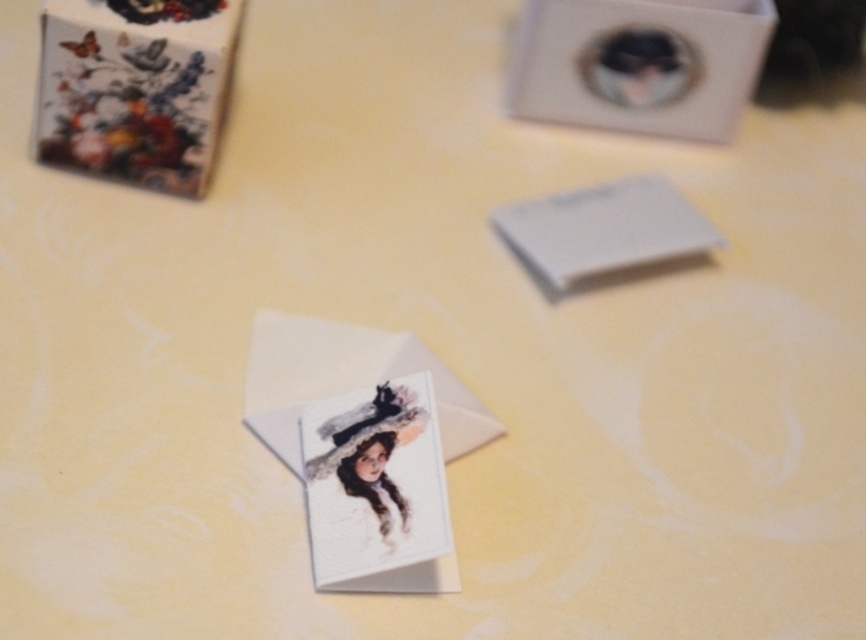
You are a photographer taking a closeup shot of the watercolor paper card at center and the white paper envelope at center on a table. Which object will appear larger in your photo?

The watercolor paper card at center will appear larger in the photo because it is closer to the viewer than the white paper envelope at center.

You are organizing items on a table and need to place both the white cardboard box at upper center and the watercolor paper card at center. Since you want to ensure the smaller item is closer to the edge of the table for easy access, which item should you move closer to the edge?

The watercolor paper card at center is smaller than the white cardboard box at upper center, so you should move the watercolor paper card at center closer to the edge of the table for easier access.

You are looking at the two points on the table, point 1 at coordinates point (383, 547) and point 2 at coordinates point (389, 365). Which point is closer to you?

Point 1 at coordinates point (383, 547) is closer to you than point 2 at coordinates point (389, 365).